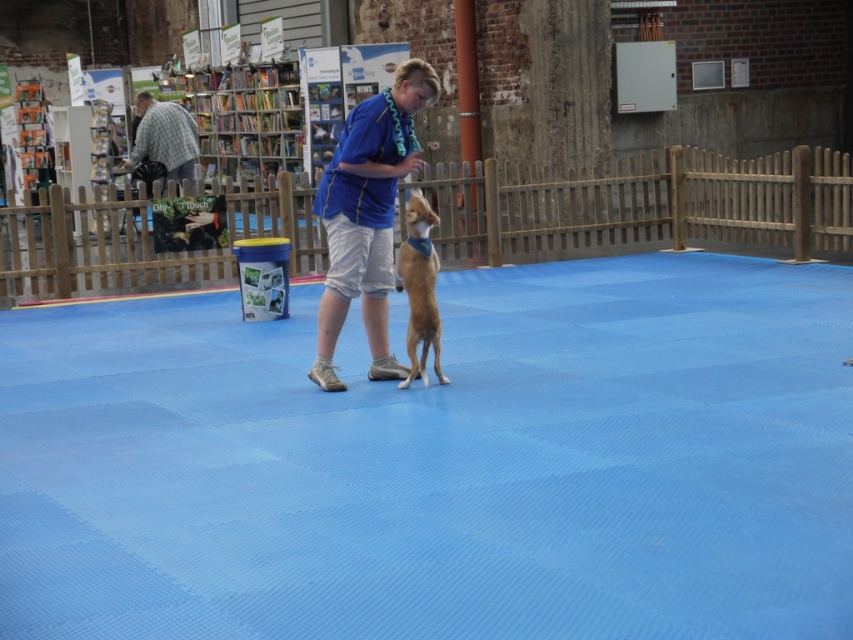
Question: Which object appears closest to the camera in this image?

Choices:
 (A) checkered fabric shirt at left
 (B) blue fabric shirt at center
 (C) brown fur dog at center

Answer: (B)

Question: Is brown fur dog at center smaller than checkered fabric shirt at left?

Choices:
 (A) yes
 (B) no

Answer: (A)

Question: Is brown fur dog at center positioned in front of checkered fabric shirt at left?

Choices:
 (A) yes
 (B) no

Answer: (A)

Question: Among these points, which one is farthest from the camera?

Choices:
 (A) (396, 118)
 (B) (178, 150)
 (C) (421, 316)

Answer: (B)

Question: Is brown fur dog at center thinner than checkered fabric shirt at left?

Choices:
 (A) yes
 (B) no

Answer: (A)

Question: Considering the real-world distances, which object is farthest from the blue fabric shirt at center?

Choices:
 (A) brown fur dog at center
 (B) checkered fabric shirt at left

Answer: (B)